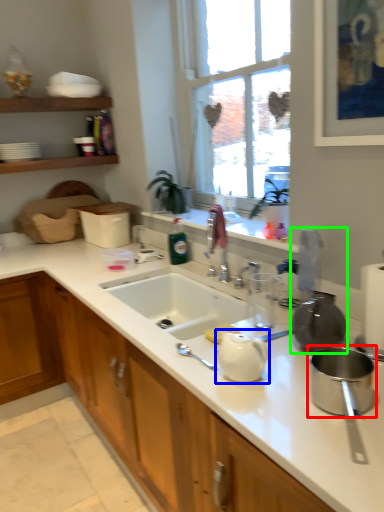
Question: Based on their relative distances, which object is farther from appliance (highlighted by a red box)? Choose from tea pot (highlighted by a blue box) and appliance (highlighted by a green box).

Choices:
 (A) tea pot
 (B) appliance

Answer: (A)